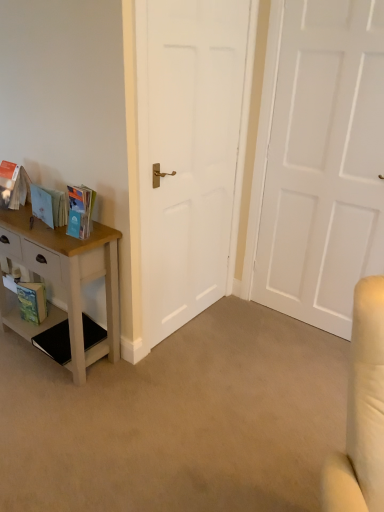
Question: From the image's perspective, is white matte door at center, the first door positioned from the right, beneath matte cardboard book at left, the second book viewed from the left?

Choices:
 (A) yes
 (B) no

Answer: (B)

Question: Is white matte door at center, which appears as the 2th door when viewed from the left, bigger than matte cardboard book at left, the second book positioned from the right?

Choices:
 (A) no
 (B) yes

Answer: (B)

Question: Is white matte door at center, the first door positioned from the right, behind matte cardboard book at left, the second book positioned from the right?

Choices:
 (A) yes
 (B) no

Answer: (B)

Question: Is white matte door at center, which appears as the 2th door when viewed from the left, positioned with its back to matte cardboard book at left, the second book positioned from the right?

Choices:
 (A) no
 (B) yes

Answer: (A)

Question: Can you confirm if white matte door at center, which appears as the 2th door when viewed from the left, is positioned to the left of matte cardboard book at left, the second book positioned from the right?

Choices:
 (A) no
 (B) yes

Answer: (A)

Question: Is white matte door at center, the first door positioned from the right, far away from matte cardboard book at left, the second book viewed from the left?

Choices:
 (A) no
 (B) yes

Answer: (B)

Question: Can you confirm if matte orange book at left, positioned as the first book in left-to-right order, is positioned to the left of green matte paperback book at lower left?

Choices:
 (A) yes
 (B) no

Answer: (A)

Question: Is matte orange book at left, positioned as the first book in left-to-right order, shorter than green matte paperback book at lower left?

Choices:
 (A) no
 (B) yes

Answer: (A)

Question: Is matte orange book at left, positioned as the first book in left-to-right order, turned away from green matte paperback book at lower left?

Choices:
 (A) yes
 (B) no

Answer: (B)

Question: Is matte orange book at left, positioned as the first book in left-to-right order, outside of green matte paperback book at lower left?

Choices:
 (A) yes
 (B) no

Answer: (A)

Question: Is matte orange book at left, positioned as the first book in left-to-right order, bigger than green matte paperback book at lower left?

Choices:
 (A) yes
 (B) no

Answer: (A)

Question: Is green matte paperback book at lower left far away from matte cardboard book at left, the second book positioned from the right?

Choices:
 (A) no
 (B) yes

Answer: (A)